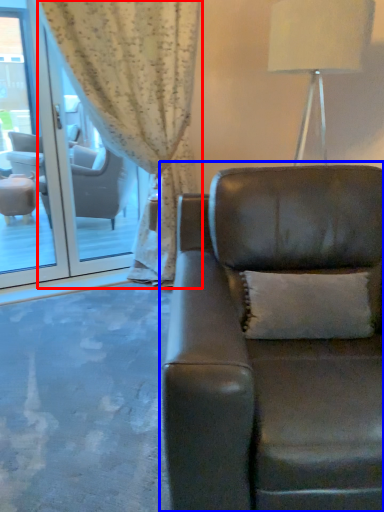
Question: Which object appears closest to the camera in this image, curtain (highlighted by a red box) or studio couch (highlighted by a blue box)?

Choices:
 (A) curtain
 (B) studio couch

Answer: (B)